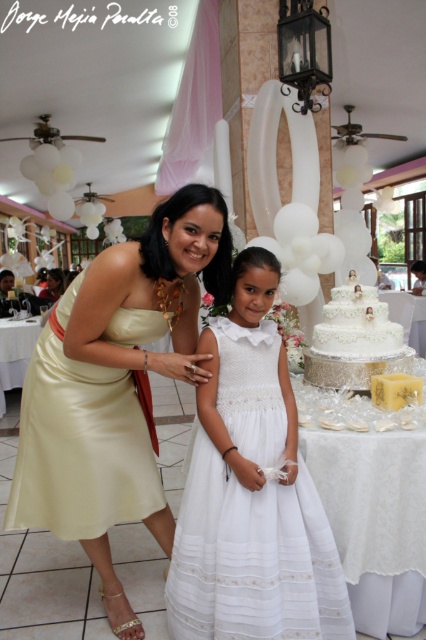
Question: Considering the real-world distances, which object is closest to the satin white dress at center?

Choices:
 (A) satin gold dress at left
 (B) white textured cake at center

Answer: (A)

Question: Is white sheer dress at center to the right of satin gold dress at left from the viewer's perspective?

Choices:
 (A) yes
 (B) no

Answer: (A)

Question: Is satin gold dress at left to the right of white textured cake at center from the viewer's perspective?

Choices:
 (A) yes
 (B) no

Answer: (B)

Question: Which object is the closest to the white textured cake at center?

Choices:
 (A) satin white dress at center
 (B) satin gold dress at left
 (C) white sheer dress at center

Answer: (C)

Question: Does white sheer dress at center appear on the left side of white textured cake at center?

Choices:
 (A) no
 (B) yes

Answer: (B)

Question: Which is farther from the white textured cake at center?

Choices:
 (A) satin gold dress at left
 (B) white sheer dress at center

Answer: (A)